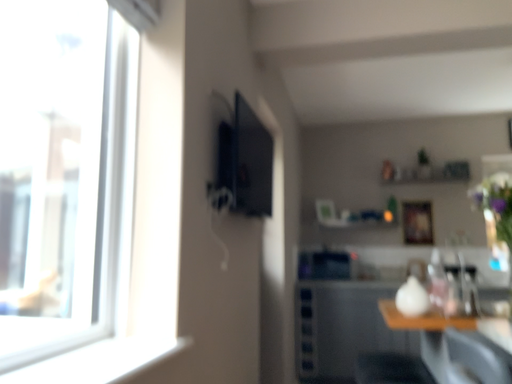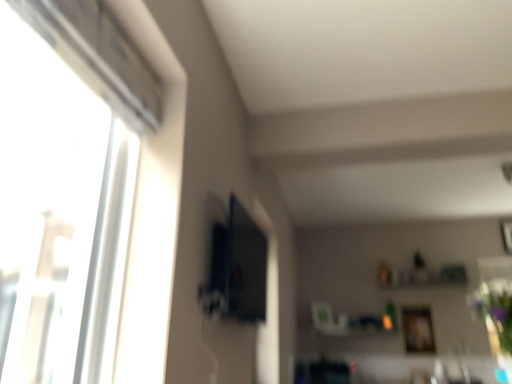
Question: How did the camera likely rotate when shooting the video?

Choices:
 (A) rotated downward
 (B) rotated upward

Answer: (B)